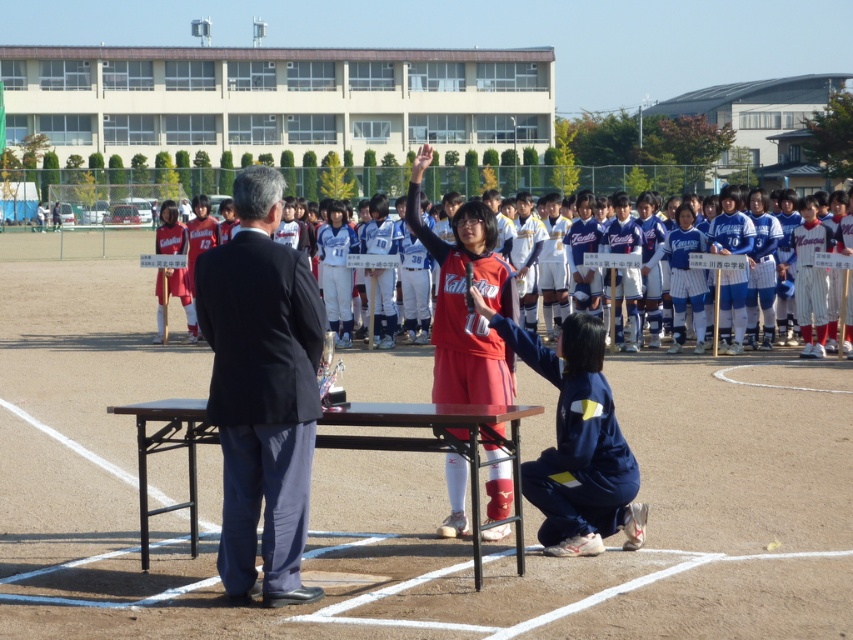
Question: Where is black suit at center located in relation to navy blue fabric uniform at lower center in the image?

Choices:
 (A) above
 (B) below

Answer: (A)

Question: Estimate the real-world distances between objects in this image. Which object is closer to the wooden table at center?

Choices:
 (A) matte red uniform at center
 (B) black suit at center
 (C) matte red jersey at center

Answer: (B)

Question: Can you confirm if wooden table at center is positioned to the left of matte red uniform at center?

Choices:
 (A) yes
 (B) no

Answer: (B)

Question: Which of the following is the farthest from the observer?

Choices:
 (A) (468, 289)
 (B) (340, 416)

Answer: (A)

Question: Can you confirm if black suit at center is positioned below matte red uniform at center?

Choices:
 (A) yes
 (B) no

Answer: (A)

Question: Based on their relative distances, which object is nearer to the navy blue fabric uniform at lower center?

Choices:
 (A) wooden table at center
 (B) matte red jersey at center

Answer: (A)